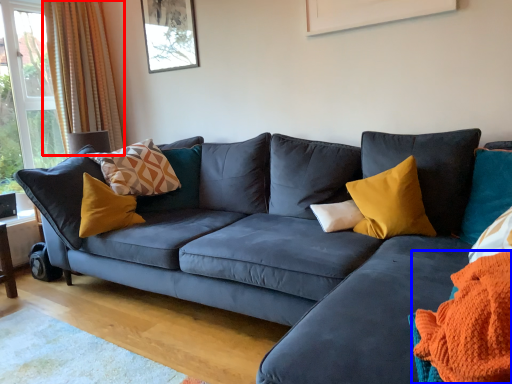
Question: Which of the following is the farthest to the observer, curtain (highlighted by a red box) or blanket (highlighted by a blue box)?

Choices:
 (A) curtain
 (B) blanket

Answer: (A)